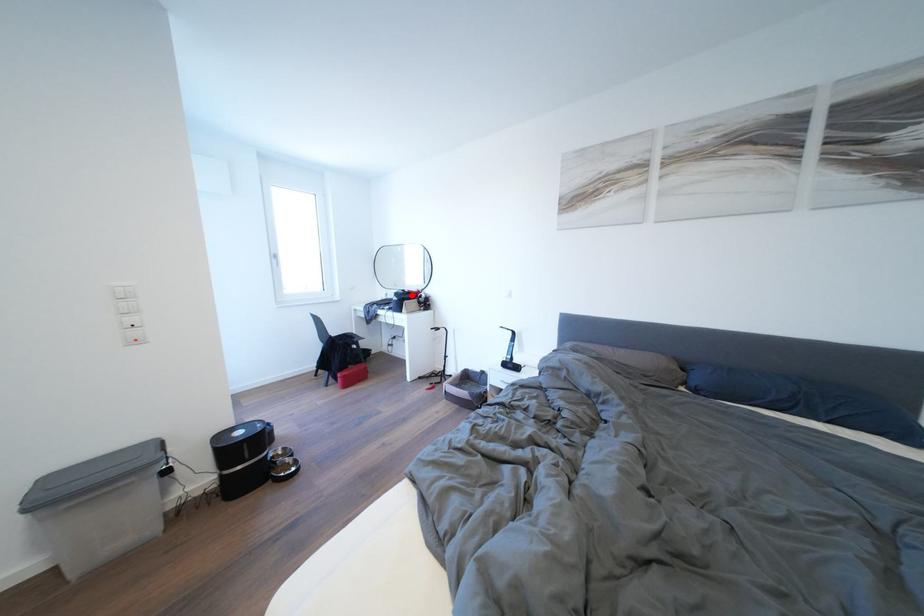
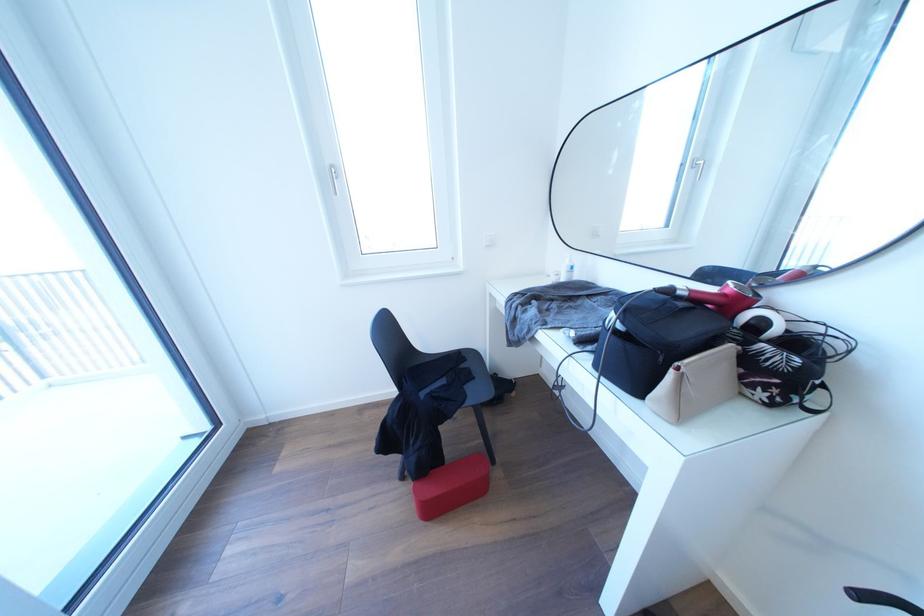
Where in the second image is the point corresponding to the highlighted location from the first image?

(675, 296)